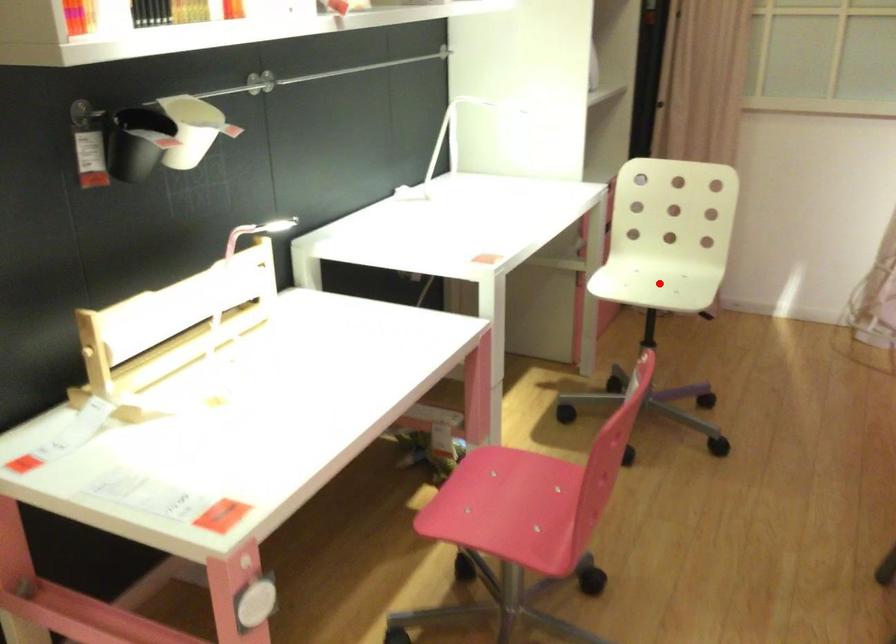
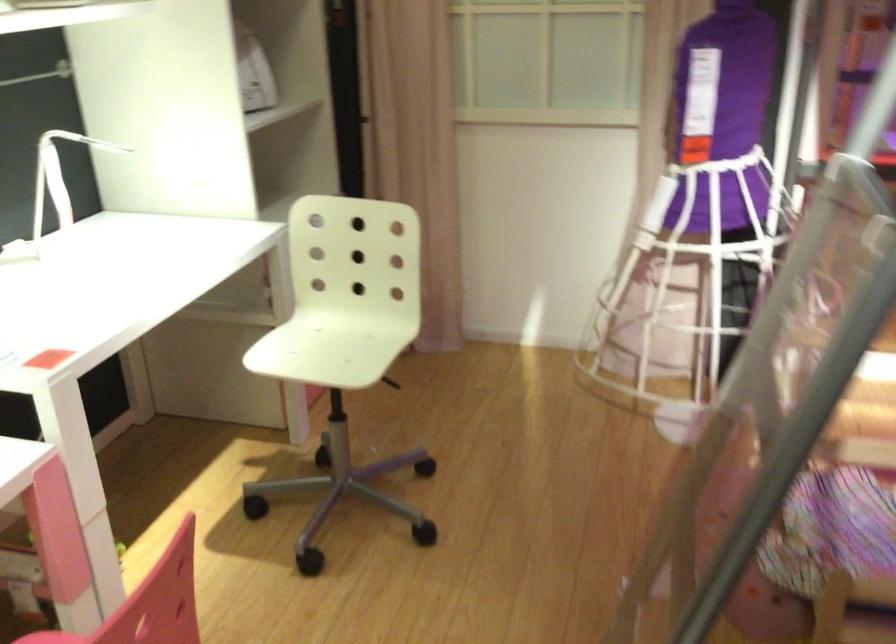
Question: I am providing you with two images of the same scene from different viewpoints. In image1, a red point is highlighted. Considering the same 3D point in image2, which of the following is correct?

Choices:
 (A) It is closer
 (B) It is farther

Answer: (A)